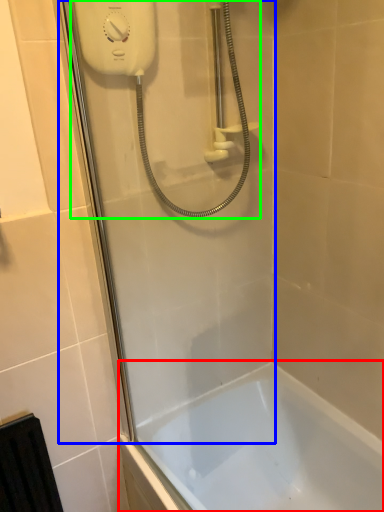
Question: Based on their relative distances, which object is nearer to bathtub (highlighted by a red box)? Choose from shower door (highlighted by a blue box) and shower (highlighted by a green box).

Choices:
 (A) shower door
 (B) shower

Answer: (A)